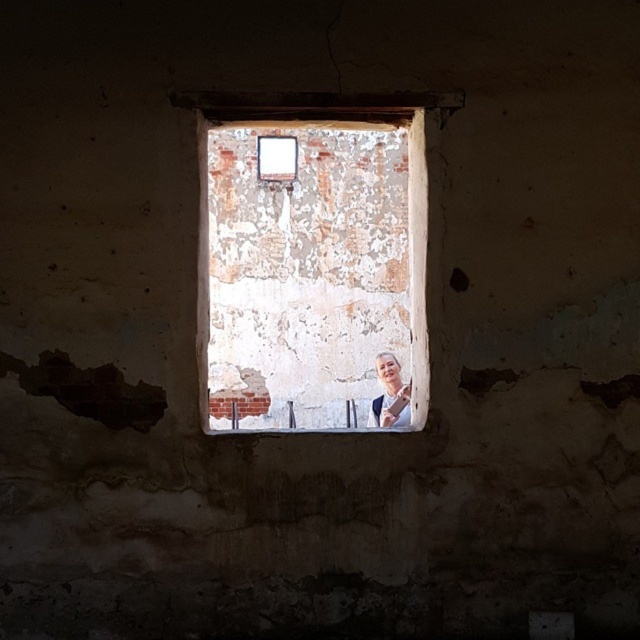
You are an artist trying to paint a scene of the old building. You want to focus on the white peeling paint at center and the smooth beige woman at center. Which object should you paint first if you want to emphasize the larger one?

You should paint the white peeling paint at center first because it is bigger than the smooth beige woman at center.

You are an inspector checking the condition of the building. You notice a specific point on the wall marked as point (310,262). Based on the scene, what is the condition of the wall at that point?

The point (310,262) indicates white peeling paint at center, so the wall at that point has peeling paint which is part of the aged and weathered appearance of the building.